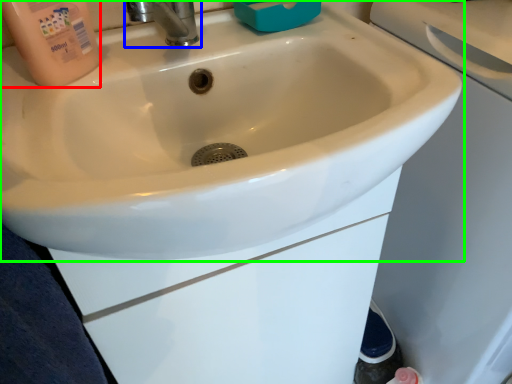
Question: Estimate the real-world distances between objects in this image. Which object is farther from cleaning product (highlighted by a red box), tap (highlighted by a blue box) or sink (highlighted by a green box)?

Choices:
 (A) tap
 (B) sink

Answer: (B)